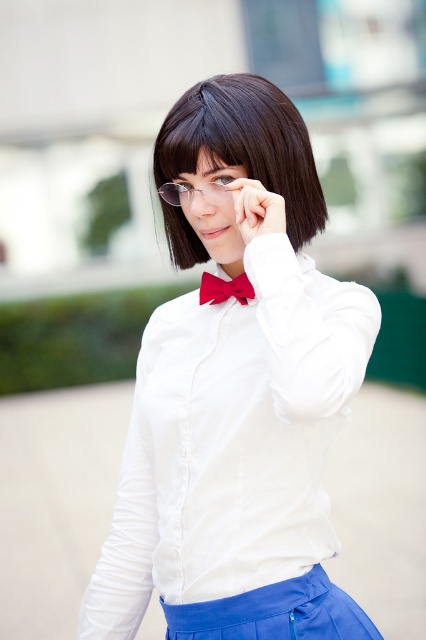
You are a photographer trying to capture the perfect shot of the person adjusting their glasses. Based on the scene, can you tell me whether the matte white hand at center is to the left or right of the clear plastic glasses at center?

The matte white hand at center is positioned on the right side of the clear plastic glasses at center.

You are a photographer adjusting the lighting for a portrait. The subject has black silky hair at upper center and a red satin bow tie at center. You need to ensure the distance between these two features is at least 12 inches to avoid overlapping shadows. Based on the scene description, will the current distance meet your requirement?

The black silky hair at upper center is only 10.00 inches from the red satin bow tie at center, which is less than the required 12 inches. Therefore, the current distance does not meet the requirement to avoid overlapping shadows.

You are taking a photo of the person in the image. You want to focus on the point that is closer to the camera. Which point should you choose between point [198,173] and point [233,289]?

Point [198,173] is closer to the camera than point [233,289], so you should choose point [198,173] to focus on.